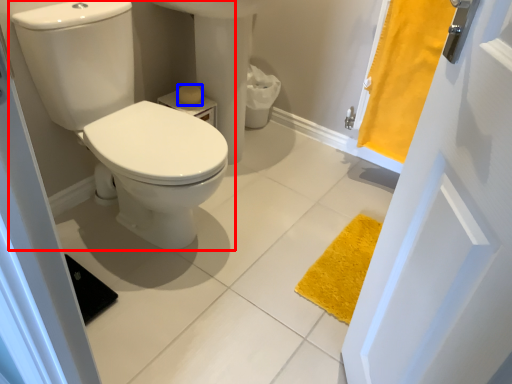
Question: Which point is closer to the camera, toilet (highlighted by a red box) or toilet paper (highlighted by a blue box)?

Choices:
 (A) toilet
 (B) toilet paper

Answer: (A)